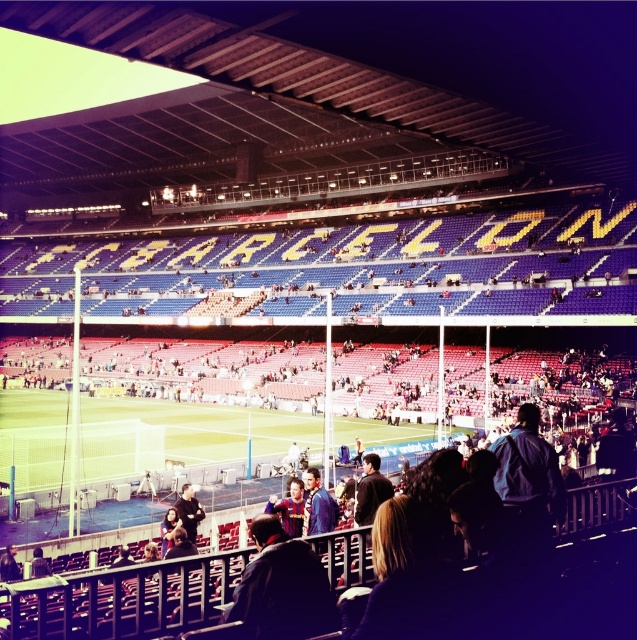
Question: Can you confirm if blue fabric jacket at center is bigger than dark blue jacket at lower center?

Choices:
 (A) no
 (B) yes

Answer: (A)

Question: Which point is farther to the camera?

Choices:
 (A) blue fabric jacket at center
 (B) dark blue jacket at lower center

Answer: (B)

Question: Which of the following is the farthest from the observer?

Choices:
 (A) dark blue jacket at lower center
 (B) blue fabric jacket at center

Answer: (A)

Question: Observing the image, what is the correct spatial positioning of blue fabric jacket at center in reference to dark blue jacket at lower center?

Choices:
 (A) right
 (B) left

Answer: (A)

Question: Is blue fabric jacket at center thinner than dark blue jacket at lower center?

Choices:
 (A) yes
 (B) no

Answer: (A)